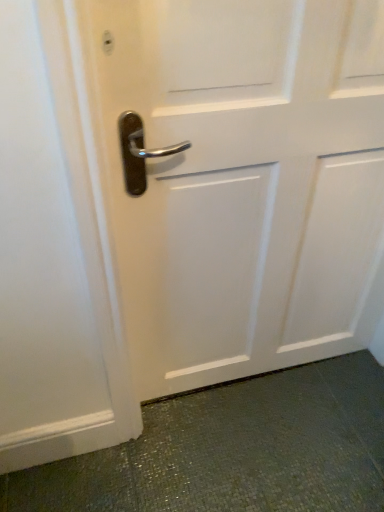
The width and height of the screenshot is (384, 512). Describe the element at coordinates (242, 181) in the screenshot. I see `white matte door handle at center` at that location.

This screenshot has height=512, width=384. In order to click on white matte door handle at center in this screenshot , I will do `click(242, 181)`.

In order to click on white matte door handle at center in this screenshot , I will do tap(242, 181).